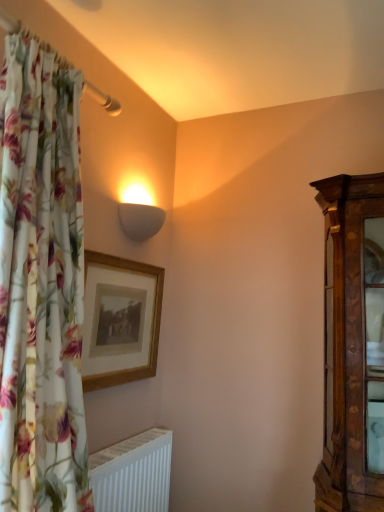
Question: Considering the positions of point (158, 438) and point (97, 305), is point (158, 438) closer or farther from the camera than point (97, 305)?

Choices:
 (A) closer
 (B) farther

Answer: (B)

Question: In terms of size, does white matte radiator at lower left appear bigger or smaller than wooden picture frame at upper center?

Choices:
 (A) small
 (B) big

Answer: (B)

Question: Estimate the real-world distances between objects in this image. Which object is closer to the wooden picture frame at upper center?

Choices:
 (A) white matte radiator at lower left
 (B) white matte wall sconce at upper center

Answer: (B)

Question: Which object is the closest to the white matte radiator at lower left?

Choices:
 (A) white matte wall sconce at upper center
 (B) wooden picture frame at upper center

Answer: (B)